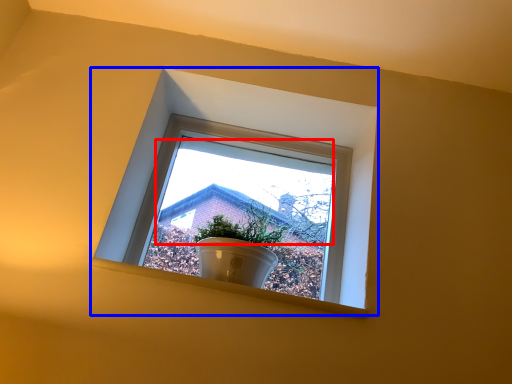
Question: Which of the following is the closest to the observer, morning light (highlighted by a red box) or window (highlighted by a blue box)?

Choices:
 (A) morning light
 (B) window

Answer: (A)